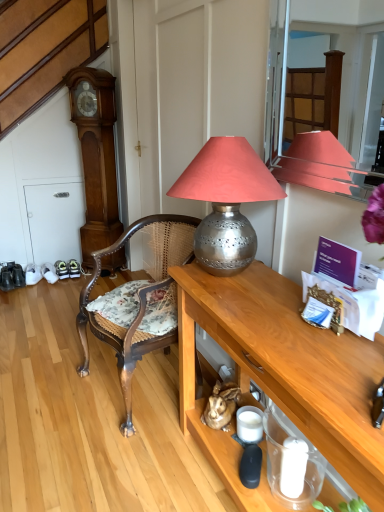
Question: Can you confirm if woven cane chair at center is positioned to the left of wooden grandfather clock at left?

Choices:
 (A) no
 (B) yes

Answer: (A)

Question: Is woven cane chair at center oriented away from wooden grandfather clock at left?

Choices:
 (A) no
 (B) yes

Answer: (A)

Question: Could you tell me if woven cane chair at center is facing wooden grandfather clock at left?

Choices:
 (A) no
 (B) yes

Answer: (A)

Question: Considering the relative sizes of woven cane chair at center and wooden grandfather clock at left in the image provided, is woven cane chair at center smaller than wooden grandfather clock at left?

Choices:
 (A) yes
 (B) no

Answer: (B)

Question: From a real-world perspective, is woven cane chair at center positioned over wooden grandfather clock at left based on gravity?

Choices:
 (A) no
 (B) yes

Answer: (A)

Question: Does woven cane chair at center have a larger size compared to wooden grandfather clock at left?

Choices:
 (A) yes
 (B) no

Answer: (A)

Question: Would you say wooden grandfather clock at left is a long distance from woven cane chair at center?

Choices:
 (A) no
 (B) yes

Answer: (B)

Question: From the image's perspective, is wooden grandfather clock at left on woven cane chair at center?

Choices:
 (A) yes
 (B) no

Answer: (A)

Question: Considering the relative sizes of wooden grandfather clock at left and woven cane chair at center in the image provided, is wooden grandfather clock at left shorter than woven cane chair at center?

Choices:
 (A) no
 (B) yes

Answer: (A)

Question: Is wooden grandfather clock at left further to the viewer compared to woven cane chair at center?

Choices:
 (A) no
 (B) yes

Answer: (B)

Question: Is wooden grandfather clock at left not inside woven cane chair at center?

Choices:
 (A) no
 (B) yes

Answer: (B)

Question: Is wooden grandfather clock at left in contact with woven cane chair at center?

Choices:
 (A) yes
 (B) no

Answer: (B)

Question: Are wooden table at center and wooden grandfather clock at left making contact?

Choices:
 (A) no
 (B) yes

Answer: (A)